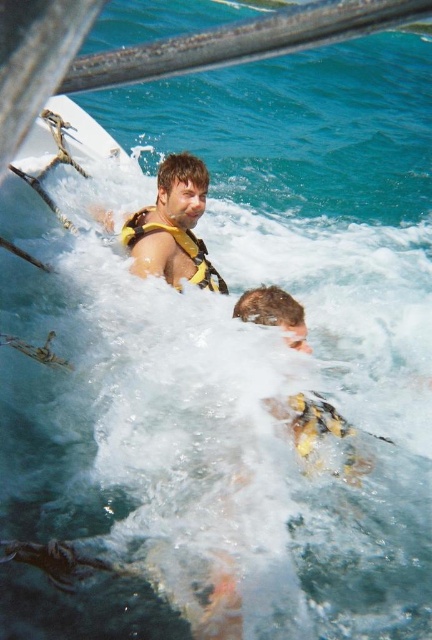
Question: Does yellow life vest at upper center appear on the left side of yellow/yellowish fabric life jacket at upper center?

Choices:
 (A) yes
 (B) no

Answer: (A)

Question: Does yellow life vest at upper center have a lesser width compared to yellow/yellowish fabric life jacket at upper center?

Choices:
 (A) no
 (B) yes

Answer: (A)

Question: Among these objects, which one is nearest to the camera?

Choices:
 (A) yellow/yellowish fabric life jacket at upper center
 (B) yellow life vest at upper center

Answer: (B)

Question: Is yellow life vest at upper center wider than yellow/yellowish fabric life jacket at upper center?

Choices:
 (A) yes
 (B) no

Answer: (A)

Question: Which object appears closest to the camera in this image?

Choices:
 (A) yellow/yellowish fabric life jacket at upper center
 (B) yellow life vest at upper center

Answer: (B)